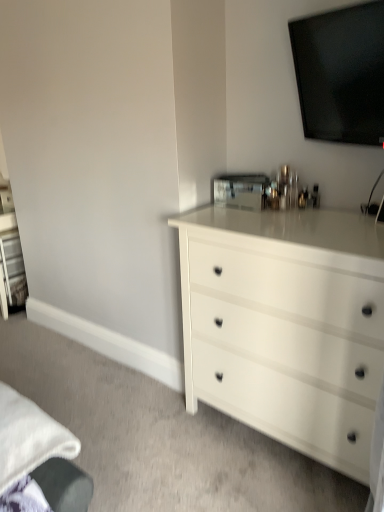
Question: Choose the correct answer: Is black glossy tv at upper center inside white glossy chest of drawers at center or outside it?

Choices:
 (A) outside
 (B) inside

Answer: (A)

Question: Is black glossy tv at upper center taller or shorter than white glossy chest of drawers at center?

Choices:
 (A) tall
 (B) short

Answer: (B)

Question: Visually, is black glossy tv at upper center positioned to the left or to the right of white glossy chest of drawers at center?

Choices:
 (A) right
 (B) left

Answer: (A)

Question: Considering the positions of white glossy chest of drawers at center and black glossy tv at upper center in the image, is white glossy chest of drawers at center taller or shorter than black glossy tv at upper center?

Choices:
 (A) short
 (B) tall

Answer: (B)

Question: Considering the positions of white glossy chest of drawers at center and black glossy tv at upper center in the image, is white glossy chest of drawers at center bigger or smaller than black glossy tv at upper center?

Choices:
 (A) big
 (B) small

Answer: (A)

Question: Is white glossy chest of drawers at center inside or outside of black glossy tv at upper center?

Choices:
 (A) outside
 (B) inside

Answer: (A)

Question: From a real-world perspective, is white glossy chest of drawers at center positioned above or below black glossy tv at upper center?

Choices:
 (A) below
 (B) above

Answer: (A)